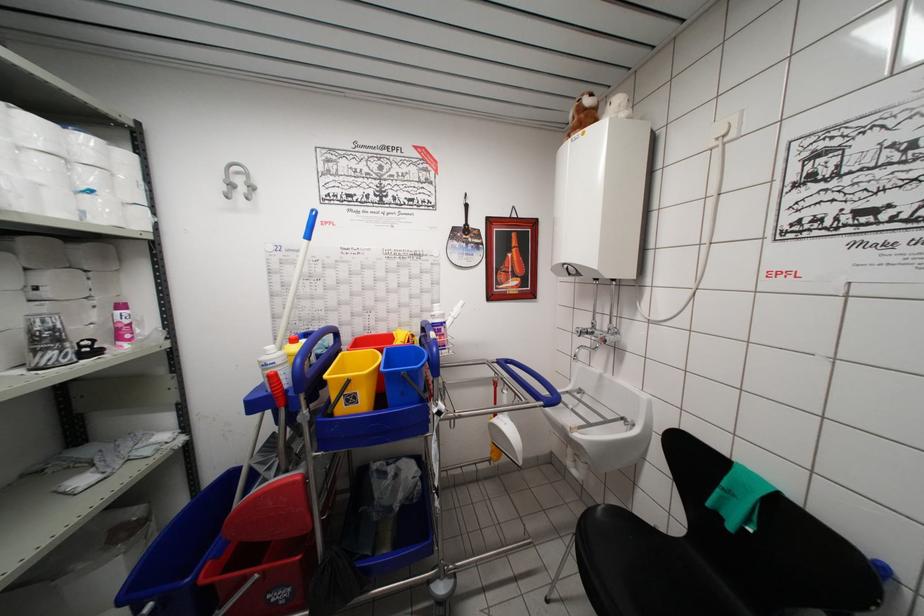
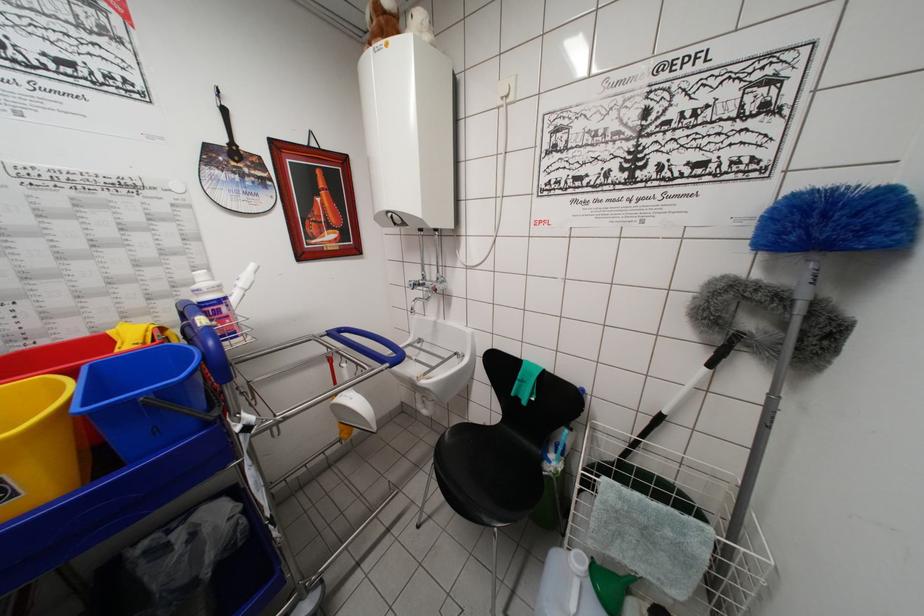
Where in the second image is the point corresponding to point 403,377 from the first image?

(136, 405)